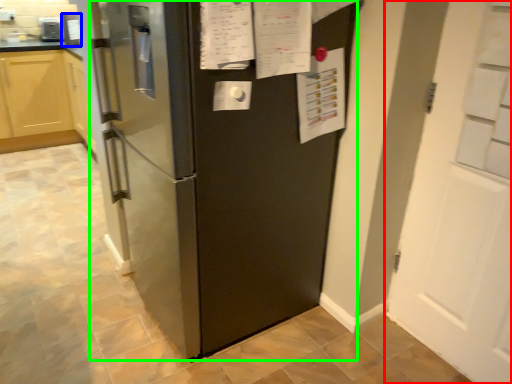
Question: Estimate the real-world distances between objects in this image. Which object is closer to door (highlighted by a red box), appliance (highlighted by a blue box) or refrigerator (highlighted by a green box)?

Choices:
 (A) appliance
 (B) refrigerator

Answer: (B)